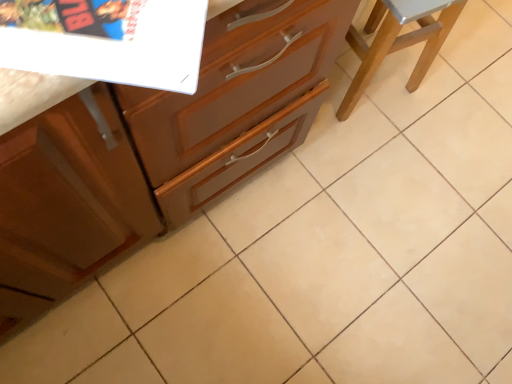
Find the location of a particular element. wooden stool at right is located at coordinates (398, 41).

Describe the element at coordinates (398, 41) in the screenshot. This screenshot has height=384, width=512. I see `wooden stool at right` at that location.

In order to click on wooden cabinet at center in this screenshot , I will do `click(158, 150)`.

The height and width of the screenshot is (384, 512). What do you see at coordinates (158, 150) in the screenshot? I see `wooden cabinet at center` at bounding box center [158, 150].

Find the location of a particular element. This screenshot has height=384, width=512. wooden stool at right is located at coordinates (398, 41).

Between wooden cabinet at center and wooden stool at right, which one appears on the left side from the viewer's perspective?

wooden cabinet at center.

Considering the positions of objects wooden cabinet at center and wooden stool at right in the image provided, who is in front, wooden cabinet at center or wooden stool at right?

Positioned in front is wooden cabinet at center.

Is point (257, 16) farther from camera compared to point (416, 43)?

No, (257, 16) is in front of (416, 43).

From the image's perspective, is wooden cabinet at center above or below wooden stool at right?

wooden cabinet at center is situated lower than wooden stool at right in the image.

From a real-world perspective, who is located lower, wooden cabinet at center or wooden stool at right?

wooden cabinet at center is physically lower.

In terms of width, does wooden cabinet at center look wider or thinner when compared to wooden stool at right?

Considering their sizes, wooden cabinet at center looks broader than wooden stool at right.

Which of these two, wooden cabinet at center or wooden stool at right, stands taller?

With more height is wooden stool at right.

Which of these two, wooden cabinet at center or wooden stool at right, is bigger?

Bigger between the two is wooden cabinet at center.

Is wooden cabinet at center situated inside wooden stool at right or outside?

wooden cabinet at center is not inside wooden stool at right, it's outside.

Is wooden cabinet at center beside wooden stool at right?

No, wooden cabinet at center is not touching wooden stool at right.

Consider the image. Does wooden cabinet at center turn towards wooden stool at right?

No, wooden cabinet at center is not aimed at wooden stool at right.

What's the angular difference between wooden cabinet at center and wooden stool at right's facing directions?

The facing directions of wooden cabinet at center and wooden stool at right are 99.3 degrees apart.

Image resolution: width=512 pixels, height=384 pixels. I want to click on furniture lying behind the wooden cabinet at center, so click(x=398, y=41).

Would you say wooden stool at right is to the left or to the right of wooden cabinet at center in the picture?

Clearly, wooden stool at right is on the right of wooden cabinet at center in the image.

From the picture: Who is more distant, wooden stool at right or wooden cabinet at center?

wooden stool at right is further from the camera.

Is point (388, 14) positioned after point (237, 162)?

Yes, point (388, 14) is behind point (237, 162).

From the image's perspective, which one is positioned lower, wooden stool at right or wooden cabinet at center?

From the image's view, wooden cabinet at center is below.

From a real-world perspective, is wooden stool at right physically above wooden cabinet at center?

Yes, from a real-world perspective, wooden stool at right is above wooden cabinet at center.

From the picture: In terms of width, does wooden stool at right look wider or thinner when compared to wooden cabinet at center?

wooden stool at right is thinner than wooden cabinet at center.

Considering the sizes of objects wooden stool at right and wooden cabinet at center in the image provided, who is shorter, wooden stool at right or wooden cabinet at center?

With less height is wooden cabinet at center.

Which of these two, wooden stool at right or wooden cabinet at center, is bigger?

Bigger between the two is wooden cabinet at center.

Is wooden stool at right positioned beyond the bounds of wooden cabinet at center?

wooden stool at right lies outside wooden cabinet at center's area.

Is wooden stool at right touching wooden cabinet at center?

No, wooden stool at right is not touching wooden cabinet at center.

Is wooden stool at right oriented away from wooden cabinet at center?

No, wooden stool at right is not facing the opposite direction of wooden cabinet at center.

Can you tell me how much wooden stool at right and wooden cabinet at center differ in facing direction?

wooden stool at right and wooden cabinet at center are facing 99.3 degrees away from each other.

Find the location of a particular element. The height and width of the screenshot is (384, 512). cabinetry below the wooden stool at right (from the image's perspective) is located at coordinates (158, 150).

The width and height of the screenshot is (512, 384). What are the coordinates of `cabinetry that is below the wooden stool at right (from the image's perspective)` in the screenshot? It's located at (158, 150).

Locate an element on the screen. The height and width of the screenshot is (384, 512). cabinetry that appears below the wooden stool at right (from a real-world perspective) is located at coordinates (158, 150).